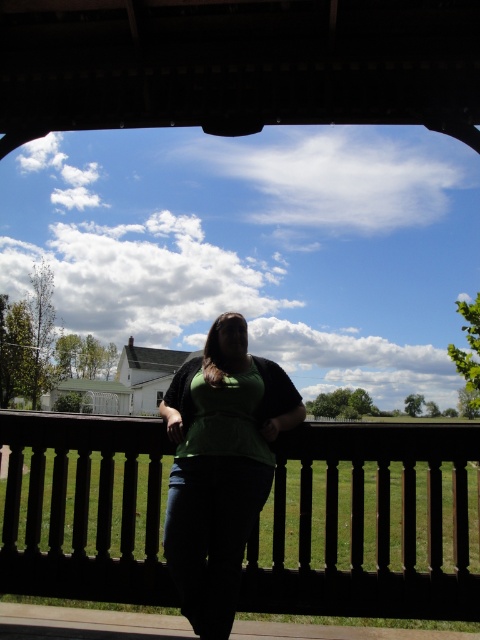
You are a painter who wants to paint the dark brown wooden porch at center and the green matte shirt at center. Which object should you paint first if you want to start with the taller one?

The green matte shirt at center is taller than the dark brown wooden porch at center, so you should paint the green matte shirt at center first.